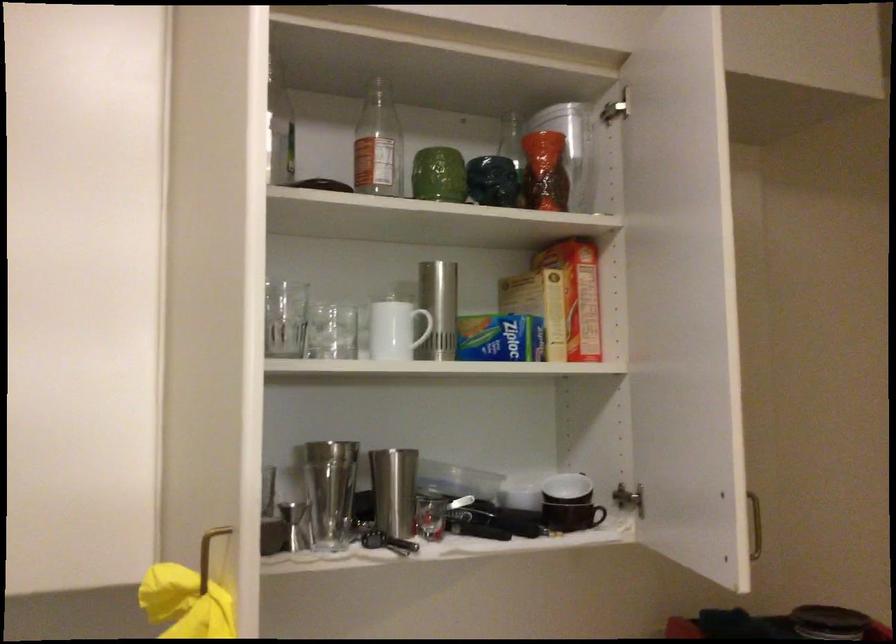
Find where to lift the white ceramic bowl. Please return your answer as a coordinate pair (x, y).

(521, 489)